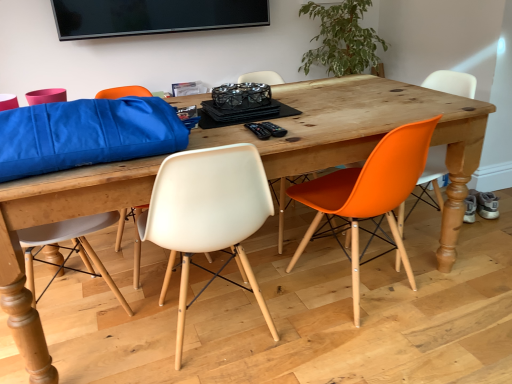
Question: Is the depth of black plastic remote control at center, the 1th remote control viewed from the right, less than that of orange matte plastic chair at right, which appears as the 2th chair when viewed from the right?

Choices:
 (A) no
 (B) yes

Answer: (A)

Question: Can you confirm if black plastic remote control at center, which is the second remote control from left to right, is thinner than orange matte plastic chair at right, which is counted as the second chair, starting from the left?

Choices:
 (A) yes
 (B) no

Answer: (A)

Question: Would you say black plastic remote control at center, the 1th remote control viewed from the right, contains orange matte plastic chair at right, which appears as the 2th chair when viewed from the right?

Choices:
 (A) no
 (B) yes

Answer: (A)

Question: Can you confirm if black plastic remote control at center, the 1th remote control viewed from the right, is bigger than orange matte plastic chair at right, which appears as the 2th chair when viewed from the right?

Choices:
 (A) yes
 (B) no

Answer: (B)

Question: Is black plastic remote control at center, the 1th remote control viewed from the right, facing away from orange matte plastic chair at right, which appears as the 2th chair when viewed from the right?

Choices:
 (A) no
 (B) yes

Answer: (A)

Question: From a real-world perspective, is white plastic chair at center, positioned as the first chair in left-to-right order, above or below orange plastic chair at right, the 1th chair positioned from the right?

Choices:
 (A) above
 (B) below

Answer: (A)

Question: Considering the positions of white plastic chair at center, which is the 3th chair from right to left, and orange plastic chair at right, the third chair positioned from the left, in the image, is white plastic chair at center, which is the 3th chair from right to left, wider or thinner than orange plastic chair at right, the third chair positioned from the left,?

Choices:
 (A) thin
 (B) wide

Answer: (B)

Question: From their relative heights in the image, would you say white plastic chair at center, positioned as the first chair in left-to-right order, is taller or shorter than orange plastic chair at right, the third chair positioned from the left?

Choices:
 (A) tall
 (B) short

Answer: (B)

Question: Visually, is white plastic chair at center, positioned as the first chair in left-to-right order, positioned to the left or to the right of orange plastic chair at right, the third chair positioned from the left?

Choices:
 (A) left
 (B) right

Answer: (A)

Question: From a real-world perspective, relative to black plastic remote control at center, which is counted as the first remote control, starting from the left, is orange matte plastic chair at right, which appears as the 2th chair when viewed from the right, vertically above or below?

Choices:
 (A) above
 (B) below

Answer: (B)

Question: Is orange matte plastic chair at right, which is counted as the second chair, starting from the left, inside or outside of black plastic remote control at center, which is counted as the first remote control, starting from the left?

Choices:
 (A) inside
 (B) outside

Answer: (B)

Question: From the image's perspective, is orange matte plastic chair at right, which appears as the 2th chair when viewed from the right, positioned above or below black plastic remote control at center, which is counted as the first remote control, starting from the left?

Choices:
 (A) above
 (B) below

Answer: (B)

Question: Relative to black plastic remote control at center, which is the 2th remote control in right-to-left order, is orange matte plastic chair at right, which is counted as the second chair, starting from the left, in front or behind?

Choices:
 (A) front
 (B) behind

Answer: (A)

Question: In the image, is black plastic remote control at center, the 1th remote control viewed from the right, positioned in front of or behind orange plastic chair at right, the 1th chair positioned from the right?

Choices:
 (A) front
 (B) behind

Answer: (A)

Question: Looking at the image, does black plastic remote control at center, the 1th remote control viewed from the right, seem bigger or smaller compared to orange plastic chair at right, the third chair positioned from the left?

Choices:
 (A) big
 (B) small

Answer: (B)